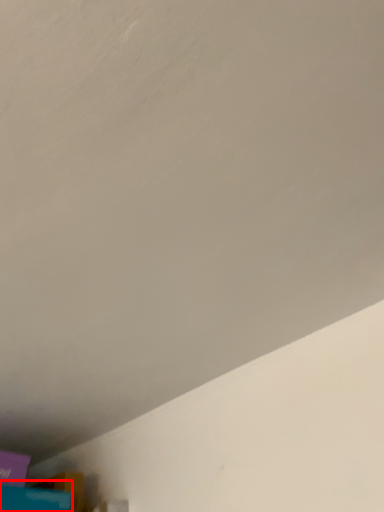
Question: From the image, what is the correct spatial relationship of wide (annotated by the red box) in relation to box?

Choices:
 (A) left
 (B) right

Answer: (B)